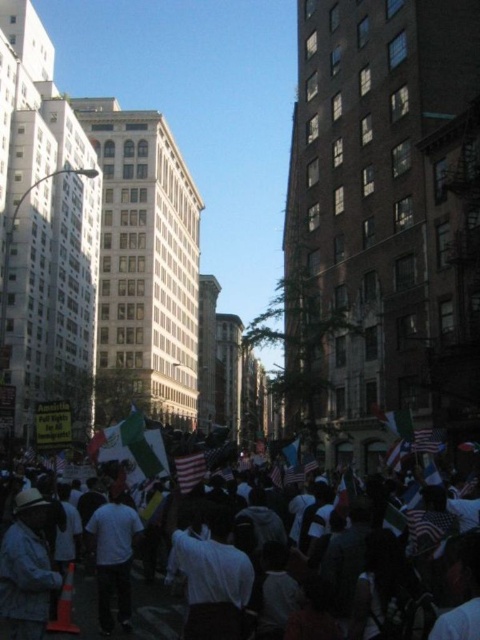
Can you confirm if dark blue denim jacket at lower left is bigger than white matte shirt at center?

Indeed, dark blue denim jacket at lower left has a larger size compared to white matte shirt at center.

The image size is (480, 640). What do you see at coordinates (26, 568) in the screenshot?
I see `dark blue denim jacket at lower left` at bounding box center [26, 568].

The width and height of the screenshot is (480, 640). Describe the element at coordinates (26, 568) in the screenshot. I see `dark blue denim jacket at lower left` at that location.

Where is `dark blue denim jacket at lower left`? dark blue denim jacket at lower left is located at coordinates (26, 568).

Is white matte shirt at center below white cotton crowd at center?

Incorrect, white matte shirt at center is not positioned below white cotton crowd at center.

Who is higher up, white matte shirt at center or white cotton crowd at center?

white matte shirt at center

Image resolution: width=480 pixels, height=640 pixels. What do you see at coordinates (113, 556) in the screenshot?
I see `white matte shirt at center` at bounding box center [113, 556].

The height and width of the screenshot is (640, 480). Identify the location of white matte shirt at center. (113, 556).

Which is above, dark blue denim jacket at lower left or american flag at center?

american flag at center

Does dark blue denim jacket at lower left appear over american flag at center?

No, dark blue denim jacket at lower left is not above american flag at center.

Which is in front, point (36, 493) or point (203, 460)?

Point (36, 493) is more forward.

You are a GUI agent. You are given a task and a screenshot of the screen. Output one action in this format:
    pyautogui.click(x=<x>, y=<y>)
    Task: Click on the dark blue denim jacket at lower left
    
    Given the screenshot: What is the action you would take?
    pyautogui.click(x=26, y=568)